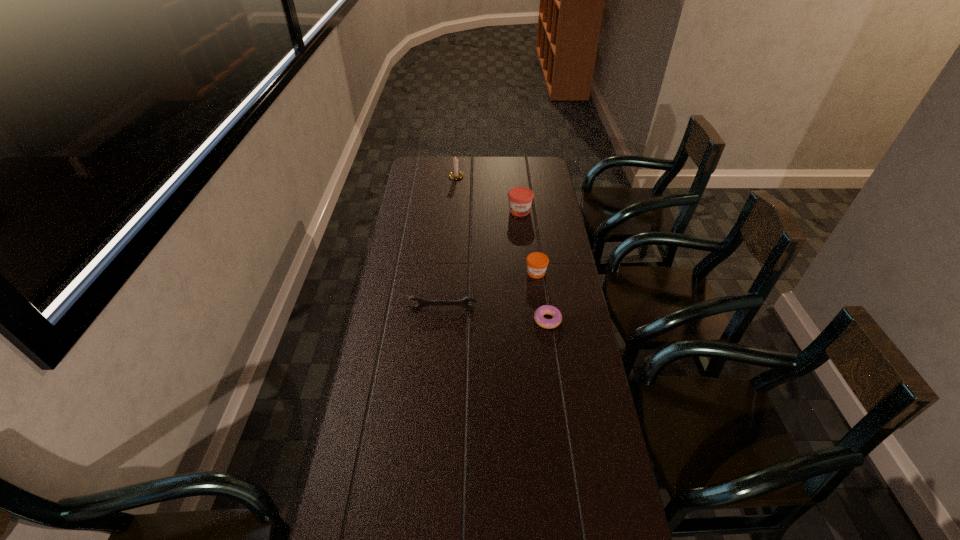
The width and height of the screenshot is (960, 540). I want to click on candle holder, so click(x=455, y=174).

Find the location of a particular element. the taller jam is located at coordinates (520, 198).

The width and height of the screenshot is (960, 540). I want to click on the fourth nearest object, so click(x=520, y=198).

This screenshot has width=960, height=540. I want to click on the third nearest object, so click(537, 262).

Identify the location of the nearer jam. (537, 262).

Where is `wrench`? This screenshot has height=540, width=960. wrench is located at coordinates (463, 302).

This screenshot has height=540, width=960. In order to click on the shortest object in this screenshot , I will do `click(545, 309)`.

The height and width of the screenshot is (540, 960). I want to click on vacant space located 0.100m on the handle side of the farthest object, so click(x=457, y=161).

The width and height of the screenshot is (960, 540). In order to click on blank area located on the handle side of the farthest object in this screenshot , I will do `click(458, 157)`.

The image size is (960, 540). Identify the location of free point located on the handle side of the farthest object. (458, 157).